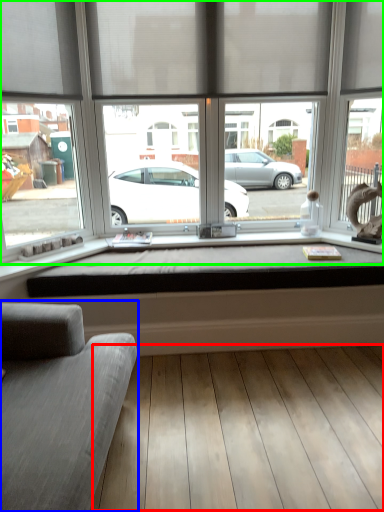
Question: Estimate the real-world distances between objects in this image. Which object is farther from plank (highlighted by a red box), studio couch (highlighted by a blue box) or window (highlighted by a green box)?

Choices:
 (A) studio couch
 (B) window

Answer: (B)